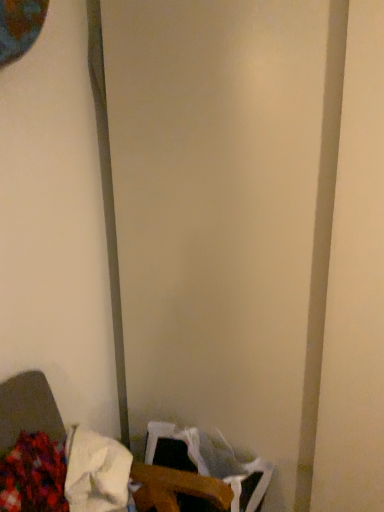
Question: From the image's perspective, would you say fluffy fabric at lower left, which appears as the second waste when viewed from the right, is shown under wooden table at lower left?

Choices:
 (A) yes
 (B) no

Answer: (B)

Question: Is the position of fluffy fabric at lower left, which appears as the second waste when viewed from the right, more distant than that of wooden table at lower left?

Choices:
 (A) no
 (B) yes

Answer: (B)

Question: Is the position of fluffy fabric at lower left, which appears as the second waste when viewed from the right, less distant than that of wooden table at lower left?

Choices:
 (A) yes
 (B) no

Answer: (B)

Question: Is fluffy fabric at lower left, which appears as the second waste when viewed from the right, in contact with wooden table at lower left?

Choices:
 (A) no
 (B) yes

Answer: (B)

Question: Is fluffy fabric at lower left, which appears as the second waste when viewed from the right, wider than wooden table at lower left?

Choices:
 (A) yes
 (B) no

Answer: (B)

Question: Could you tell me if fluffy fabric at lower left, which is counted as the 1th waste, starting from the left, is turned towards wooden table at lower left?

Choices:
 (A) yes
 (B) no

Answer: (A)

Question: Is fluffy fabric at lower left, which appears as the second waste when viewed from the right, oriented towards white fabric at lower left, the 1th waste in the right-to-left sequence?

Choices:
 (A) no
 (B) yes

Answer: (B)

Question: Is fluffy fabric at lower left, which is counted as the 1th waste, starting from the left, surrounding white fabric at lower left, the 1th waste in the right-to-left sequence?

Choices:
 (A) yes
 (B) no

Answer: (B)

Question: Does fluffy fabric at lower left, which is counted as the 1th waste, starting from the left, have a greater width compared to white fabric at lower left, marked as the second waste in a left-to-right arrangement?

Choices:
 (A) no
 (B) yes

Answer: (A)

Question: Is fluffy fabric at lower left, which is counted as the 1th waste, starting from the left, not near white fabric at lower left, marked as the second waste in a left-to-right arrangement?

Choices:
 (A) no
 (B) yes

Answer: (A)

Question: From the image's perspective, is fluffy fabric at lower left, which appears as the second waste when viewed from the right, over white fabric at lower left, the 1th waste in the right-to-left sequence?

Choices:
 (A) no
 (B) yes

Answer: (A)

Question: Does fluffy fabric at lower left, which is counted as the 1th waste, starting from the left, have a greater height compared to white fabric at lower left, marked as the second waste in a left-to-right arrangement?

Choices:
 (A) yes
 (B) no

Answer: (A)

Question: Is wooden table at lower left positioned with its back to white fabric at lower left, the 1th waste in the right-to-left sequence?

Choices:
 (A) yes
 (B) no

Answer: (A)